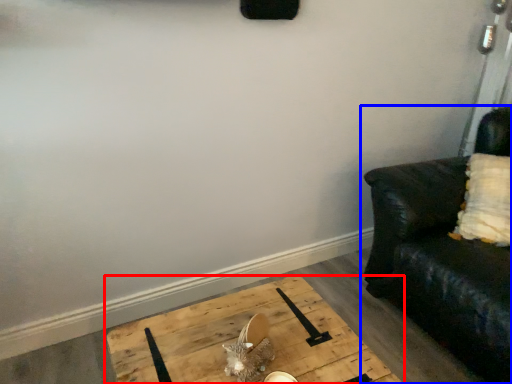
Question: Among these objects, which one is farthest to the camera, table (highlighted by a red box) or studio couch (highlighted by a blue box)?

Choices:
 (A) table
 (B) studio couch

Answer: (B)